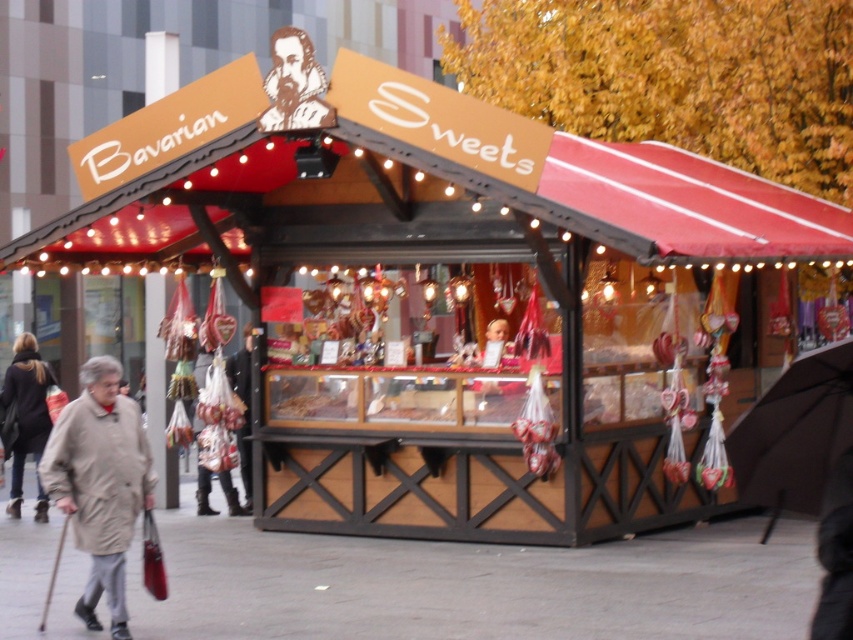
Question: Is the position of beige fabric coat at lower left more distant than that of black paper cutout at upper center?

Choices:
 (A) yes
 (B) no

Answer: (B)

Question: Which of the following is the closest to the observer?

Choices:
 (A) pyautogui.click(x=294, y=108)
 (B) pyautogui.click(x=833, y=364)
 (C) pyautogui.click(x=9, y=396)
 (D) pyautogui.click(x=48, y=625)

Answer: (B)

Question: Among these points, which one is nearest to the camera?

Choices:
 (A) (283, 61)
 (B) (103, 572)

Answer: (B)

Question: Can you confirm if beige fabric coat at lower left is thinner than black fabric umbrella at lower right?

Choices:
 (A) no
 (B) yes

Answer: (A)

Question: Is black fabric umbrella at lower right above light beige coat at lower left?

Choices:
 (A) no
 (B) yes

Answer: (B)

Question: Which of the following is the farthest from the observer?

Choices:
 (A) smooth concrete pavement at center
 (B) black fabric umbrella at lower right
 (C) black paper cutout at upper center

Answer: (C)